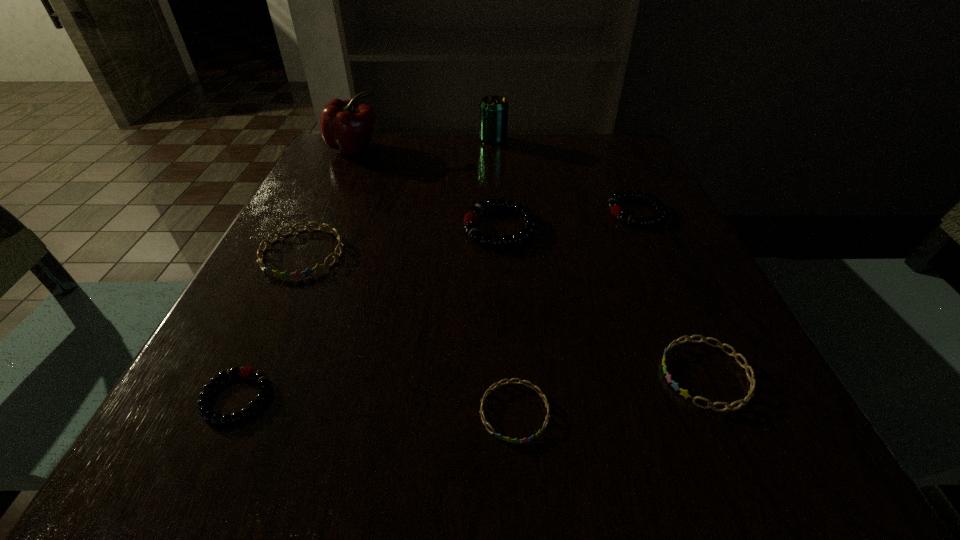
Find the location of a particular element. Image resolution: width=960 pixels, height=540 pixels. the smallest black bracelet is located at coordinates (205, 411).

Identify the location of the smallest blue bracelet. (507, 439).

Where is `the shortest object`? The image size is (960, 540). the shortest object is located at coordinates (507, 439).

The height and width of the screenshot is (540, 960). In order to click on vacant space located 0.370m on the right of the tallest object in this screenshot , I will do `click(526, 148)`.

This screenshot has width=960, height=540. I want to click on vacant region located on the front of the seventh shortest object, so click(x=496, y=195).

Where is `free location located 0.140m on the right of the second black bracelet from right to left`? The height and width of the screenshot is (540, 960). free location located 0.140m on the right of the second black bracelet from right to left is located at coordinates (608, 227).

Where is `vacant area located 0.060m on the surface of the leftmost blue bracelet showing star-shaped elements`? vacant area located 0.060m on the surface of the leftmost blue bracelet showing star-shaped elements is located at coordinates (277, 306).

Where is `free location located on the front of the rightmost black bracelet`? Image resolution: width=960 pixels, height=540 pixels. free location located on the front of the rightmost black bracelet is located at coordinates (714, 380).

The image size is (960, 540). I want to click on free region located on the surface of the rightmost blue bracelet showing star-shaped elements, so click(540, 374).

You are a GUI agent. You are given a task and a screenshot of the screen. Output one action in this format:
    pyautogui.click(x=<x>, y=<y>)
    Task: Click on the vacant space located on the surface of the rightmost blue bracelet showing star-shaped elements
    
    Given the screenshot: What is the action you would take?
    pyautogui.click(x=416, y=374)